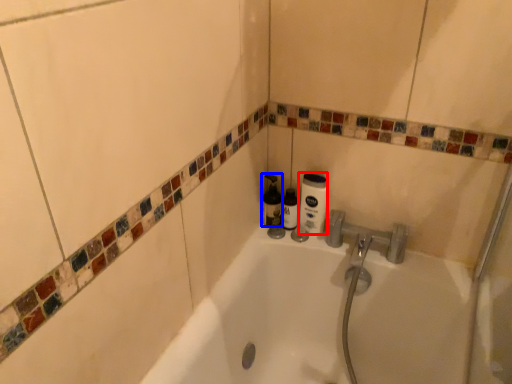
Question: Which object is further to the camera taking this photo, cleaning product (highlighted by a red box) or bottle (highlighted by a blue box)?

Choices:
 (A) cleaning product
 (B) bottle

Answer: (B)